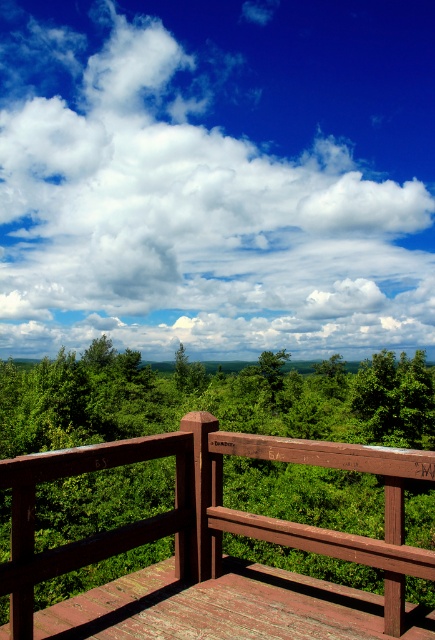
Which is behind, point (314, 45) or point (16, 518)?

The point (314, 45) is behind.

Can you confirm if white fluffy cloud at upper center is smaller than brown wooden rail at center?

Actually, white fluffy cloud at upper center might be larger than brown wooden rail at center.

Which is behind, point (351, 273) or point (110, 540)?

The point (351, 273) is more distant.

This screenshot has width=435, height=640. Find the location of `white fluffy cloud at upper center`. white fluffy cloud at upper center is located at coordinates (217, 176).